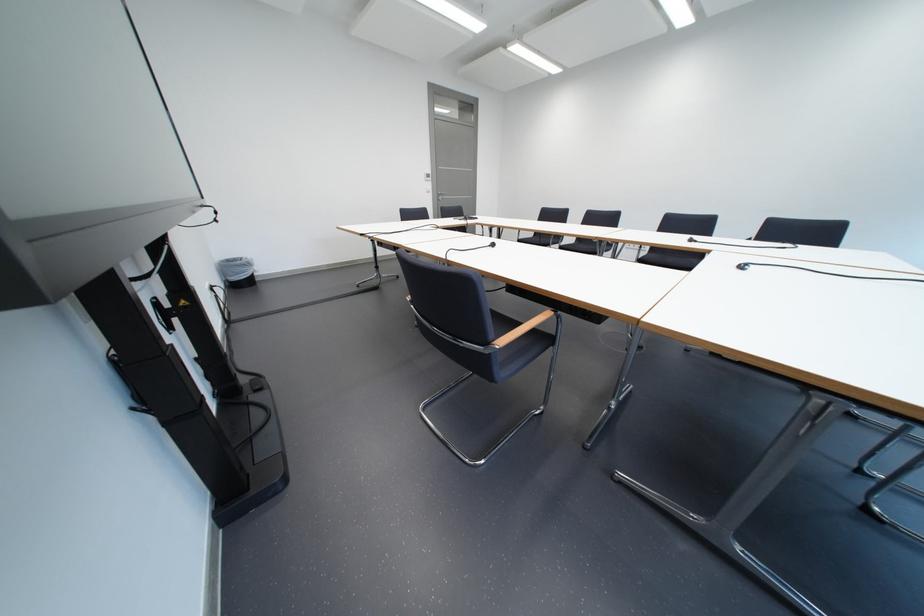
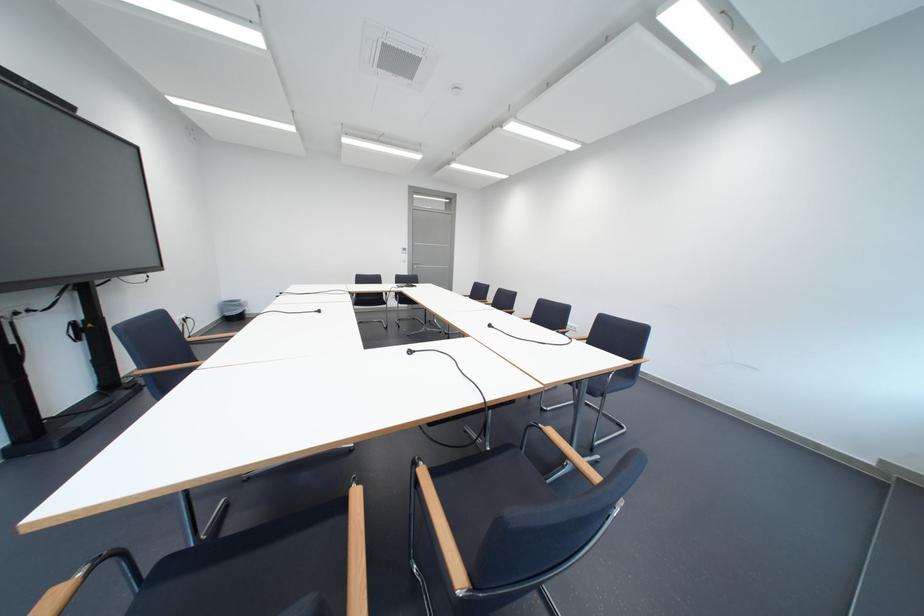
The point at [451,197] is marked in the first image. Where is the corresponding point in the second image?

(426, 265)